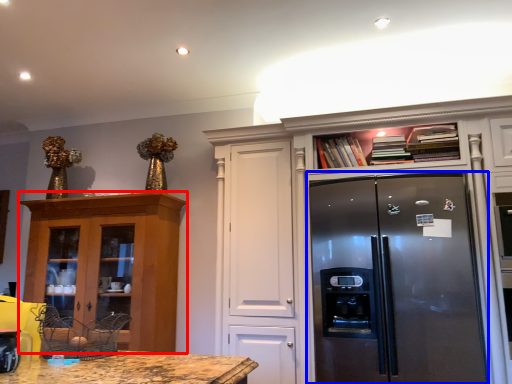
Question: Among these objects, which one is nearest to the camera, cabinetry (highlighted by a red box) or refrigerator (highlighted by a blue box)?

Choices:
 (A) cabinetry
 (B) refrigerator

Answer: (B)